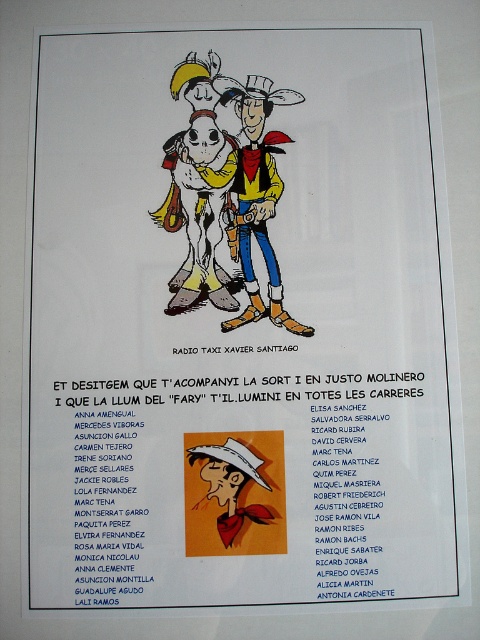
Is matte yellow cowboy hat at upper center thinner than matte orange cowboy at center?

Correct, matte yellow cowboy hat at upper center's width is less than matte orange cowboy at center's.

Can you confirm if matte yellow cowboy hat at upper center is bigger than matte orange cowboy at center?

Correct, matte yellow cowboy hat at upper center is larger in size than matte orange cowboy at center.

Between point (222, 140) and point (204, 520), which one is positioned in front?

Point (204, 520)

The image size is (480, 640). I want to click on matte yellow cowboy hat at upper center, so click(200, 182).

Does point (259, 298) come closer to viewer compared to point (254, 476)?

No.

Identify the location of matte yellow cowboy at center. The height and width of the screenshot is (640, 480). (257, 198).

Does point (223, 220) come closer to viewer compared to point (216, 445)?

No, it is behind (216, 445).

Where is `matte yellow cowboy at center`? The image size is (480, 640). matte yellow cowboy at center is located at coordinates (257, 198).

Is matte yellow cowboy hat at upper center taller than matte yellow cowboy at center?

No, matte yellow cowboy hat at upper center is not taller than matte yellow cowboy at center.

Between point (182, 83) and point (267, 100), which one is positioned behind?

Positioned behind is point (267, 100).

Identify the location of matte yellow cowboy hat at upper center. This screenshot has width=480, height=640. (200, 182).